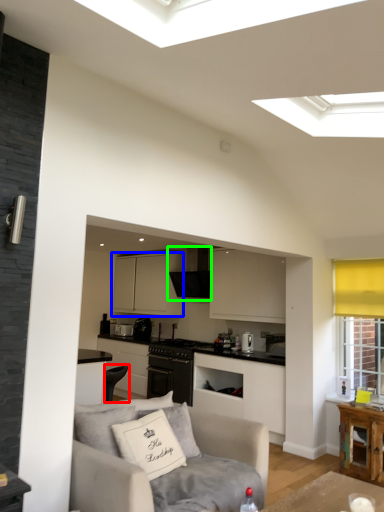
Question: Considering the real-world distances, which object is farthest from armchair (highlighted by a red box)? cabinetry (highlighted by a blue box) or exhaust hood (highlighted by a green box)?

Choices:
 (A) cabinetry
 (B) exhaust hood

Answer: (A)